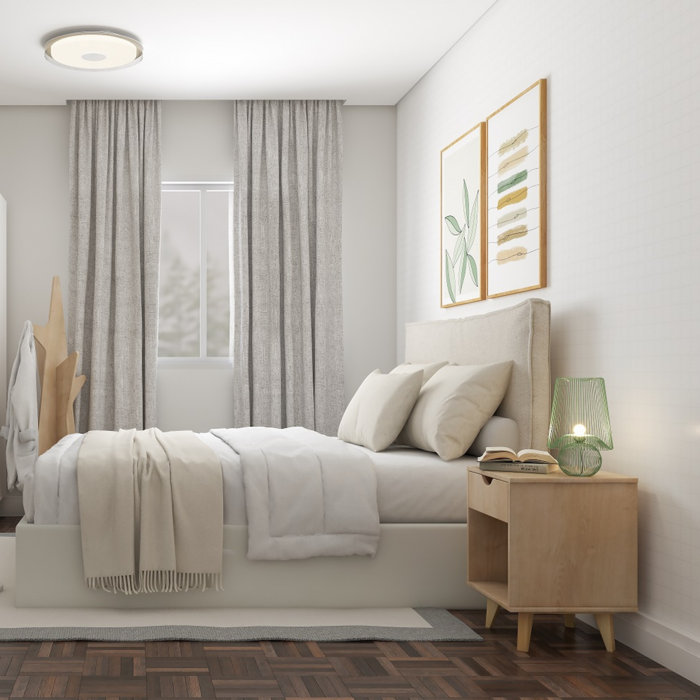
Find the location of a particular element. This screenshot has width=700, height=700. modern wooden coatrack is located at coordinates (57, 290), (69, 364), (77, 386), (60, 428), (42, 440), (38, 336).